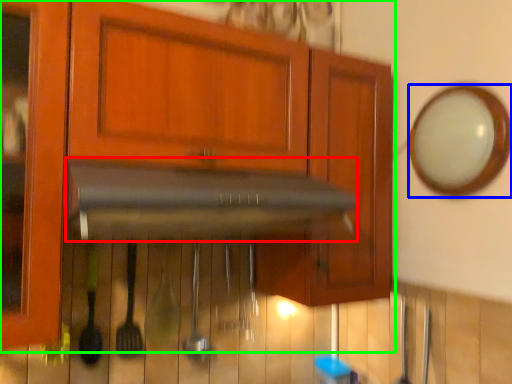
Question: Which object is the farthest from vent (highlighted by a red box)? Choose among these: mirror (highlighted by a blue box) or cabinetry (highlighted by a green box).

Choices:
 (A) mirror
 (B) cabinetry

Answer: (A)